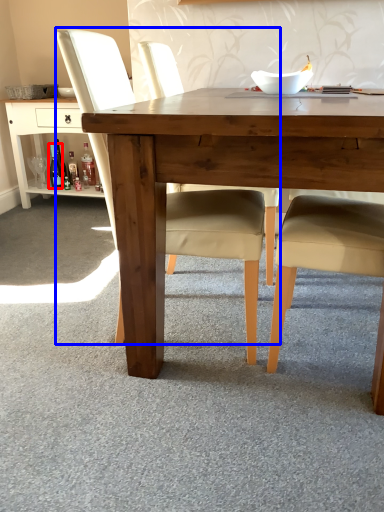
Question: Which object appears closest to the camera in this image, bottle (highlighted by a red box) or chair (highlighted by a blue box)?

Choices:
 (A) bottle
 (B) chair

Answer: (B)